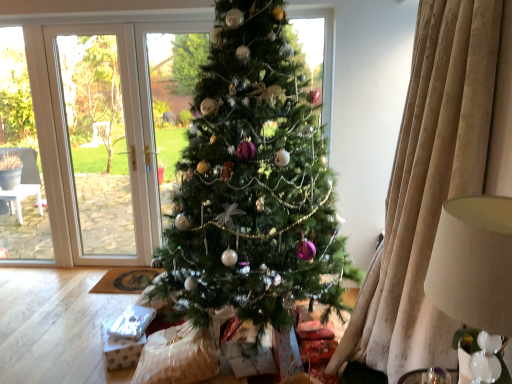
Question: Does beige fabric lampshade at right have a greater height compared to green matte christmas tree at center?

Choices:
 (A) yes
 (B) no

Answer: (B)

Question: From a real-world perspective, is beige fabric lampshade at right physically above green matte christmas tree at center?

Choices:
 (A) no
 (B) yes

Answer: (A)

Question: Is beige fabric lampshade at right shorter than green matte christmas tree at center?

Choices:
 (A) no
 (B) yes

Answer: (B)

Question: Can you confirm if beige fabric lampshade at right is bigger than green matte christmas tree at center?

Choices:
 (A) no
 (B) yes

Answer: (A)

Question: Is beige fabric lampshade at right thinner than green matte christmas tree at center?

Choices:
 (A) yes
 (B) no

Answer: (A)

Question: From a real-world perspective, is beige fabric lampshade at right beneath green matte christmas tree at center?

Choices:
 (A) no
 (B) yes

Answer: (B)

Question: From a real-world perspective, is green matte christmas tree at center physically below beige fabric lampshade at right?

Choices:
 (A) yes
 (B) no

Answer: (B)

Question: Is green matte christmas tree at center further to the viewer compared to beige fabric lampshade at right?

Choices:
 (A) yes
 (B) no

Answer: (A)

Question: Considering the relative sizes of green matte christmas tree at center and beige fabric lampshade at right in the image provided, is green matte christmas tree at center thinner than beige fabric lampshade at right?

Choices:
 (A) no
 (B) yes

Answer: (A)

Question: Does green matte christmas tree at center come in front of beige fabric lampshade at right?

Choices:
 (A) yes
 (B) no

Answer: (B)

Question: Is green matte christmas tree at center facing towards beige fabric lampshade at right?

Choices:
 (A) yes
 (B) no

Answer: (B)

Question: Considering the relative sizes of green matte christmas tree at center and beige fabric lampshade at right in the image provided, is green matte christmas tree at center shorter than beige fabric lampshade at right?

Choices:
 (A) no
 (B) yes

Answer: (A)

Question: Is green matte christmas tree at center inside or outside of beige fabric lampshade at right?

Choices:
 (A) outside
 (B) inside

Answer: (A)